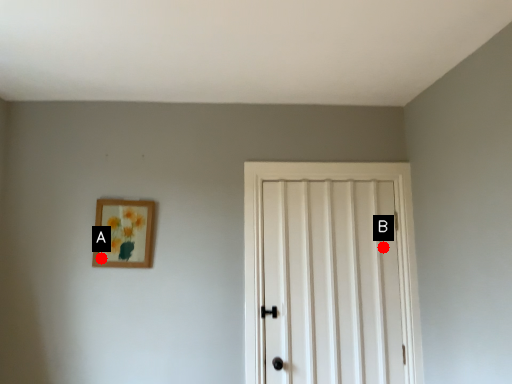
Question: Two points are circled on the image, labeled by A and B beside each circle. Which of the following is the farthest from the observer?

Choices:
 (A) A is further
 (B) B is further

Answer: (B)